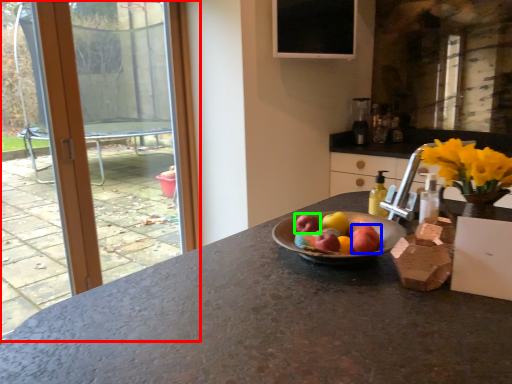
Question: Based on their relative distances, which object is nearer to window (highlighted by a red box)? Choose from apple (highlighted by a blue box) and apple (highlighted by a green box).

Choices:
 (A) apple
 (B) apple

Answer: (B)